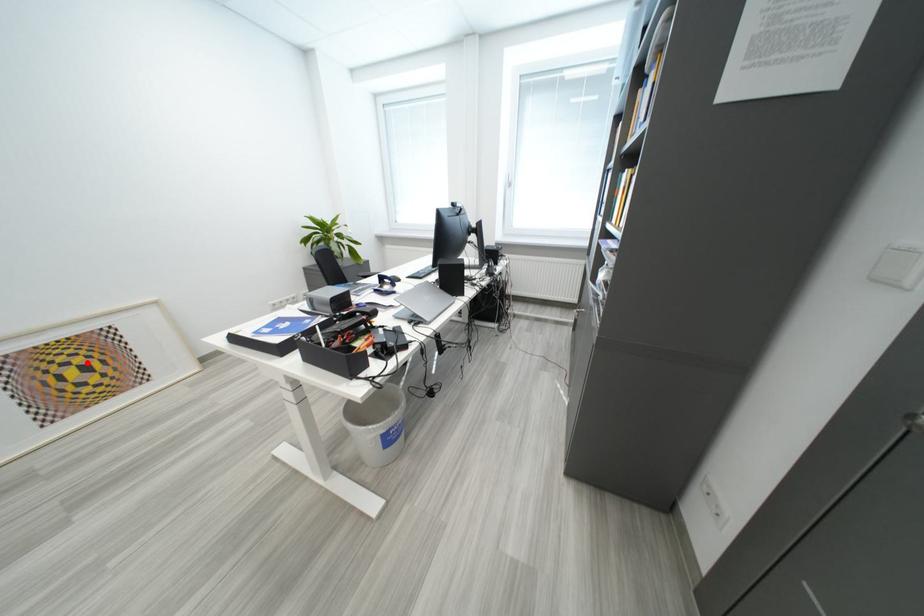
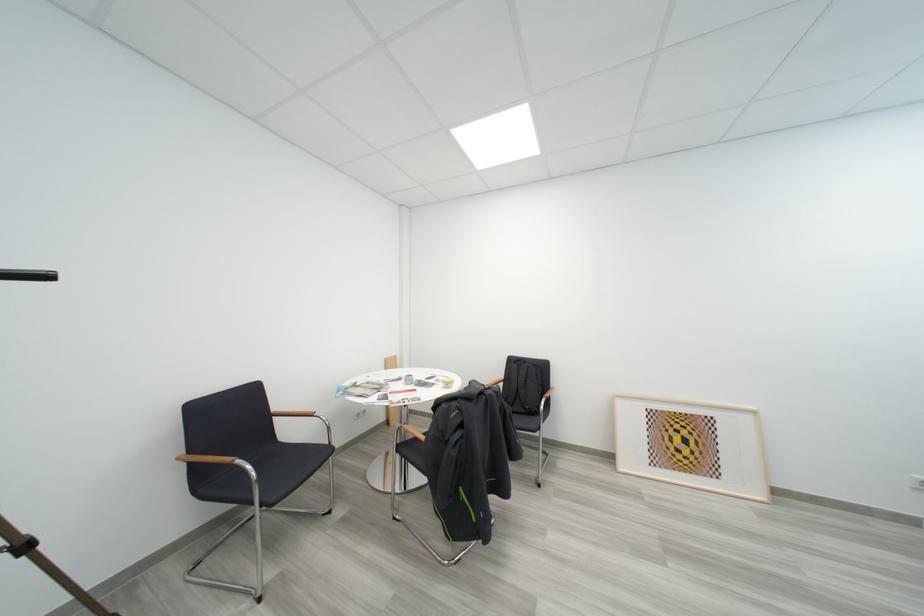
Where in the second image is the point corresponding to the highlighted location from the first image?

(693, 435)